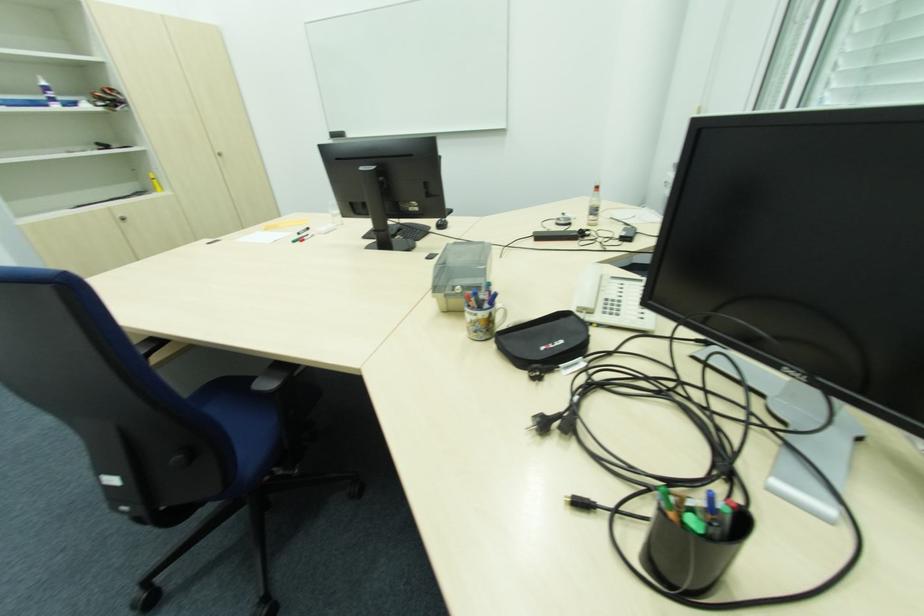
The height and width of the screenshot is (616, 924). Find the location of `telephone button`. telephone button is located at coordinates (611, 306).